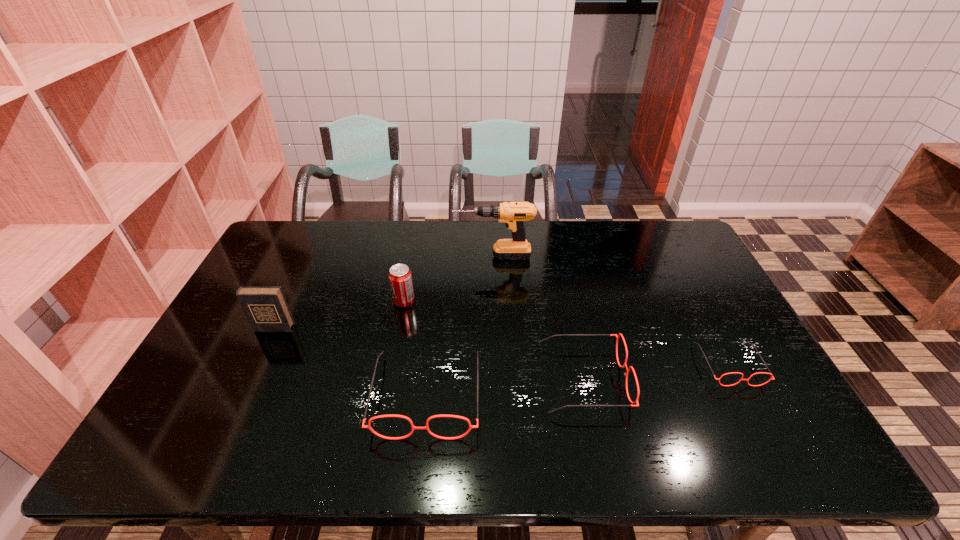
At what (x,y) coordinates should I click in order to perform the action: click on the leftmost spectacles. Please return your answer as a coordinate pair (x, y). The width and height of the screenshot is (960, 540). Looking at the image, I should click on (368, 426).

Locate an element on the screen. The width and height of the screenshot is (960, 540). the fifth tallest object is located at coordinates (617, 337).

The width and height of the screenshot is (960, 540). Identify the location of the second shortest spectacles. point(617,337).

Where is `the shortest spectacles`? Image resolution: width=960 pixels, height=540 pixels. the shortest spectacles is located at coordinates (771, 378).

The width and height of the screenshot is (960, 540). Identify the location of the rightmost spectacles. (771, 378).

Locate an element on the screen. The height and width of the screenshot is (540, 960). the tallest object is located at coordinates (513, 214).

Where is `drill`? This screenshot has height=540, width=960. drill is located at coordinates (513, 214).

Identify the location of the second farthest object. (400, 277).

The width and height of the screenshot is (960, 540). I want to click on the third tallest object, so click(x=400, y=277).

Image resolution: width=960 pixels, height=540 pixels. In order to click on diary in this screenshot , I will do `click(266, 308)`.